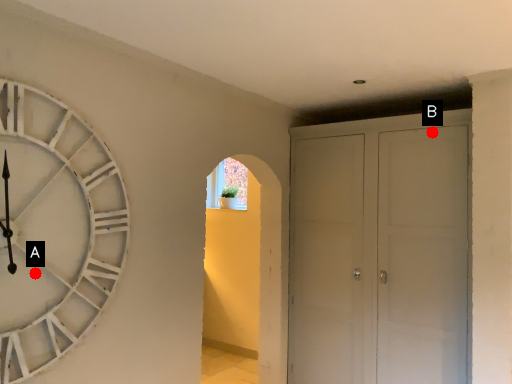
Question: Two points are circled on the image, labeled by A and B beside each circle. Which point is closer to the camera?

Choices:
 (A) A is closer
 (B) B is closer

Answer: (A)